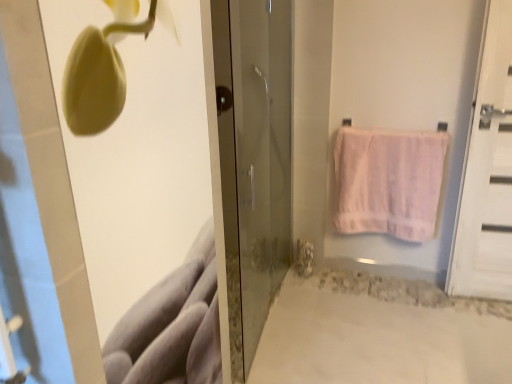
Question: Is transparent glass door at center, which is the second door in right-to-left order, wider than white wooden door at right, which ranks as the second door in left-to-right order?

Choices:
 (A) no
 (B) yes

Answer: (B)

Question: Is transparent glass door at center, which is the second door in right-to-left order, next to white wooden door at right, which ranks as the second door in left-to-right order?

Choices:
 (A) no
 (B) yes

Answer: (A)

Question: Does transparent glass door at center, arranged as the first door when viewed from the left, lie behind white wooden door at right, marked as the 1th door in a right-to-left arrangement?

Choices:
 (A) no
 (B) yes

Answer: (A)

Question: Is transparent glass door at center, arranged as the first door when viewed from the left, shorter than white wooden door at right, which ranks as the second door in left-to-right order?

Choices:
 (A) yes
 (B) no

Answer: (B)

Question: Considering the relative sizes of transparent glass door at center, which is the second door in right-to-left order, and white wooden door at right, which ranks as the second door in left-to-right order, in the image provided, is transparent glass door at center, which is the second door in right-to-left order, taller than white wooden door at right, which ranks as the second door in left-to-right order,?

Choices:
 (A) no
 (B) yes

Answer: (B)

Question: Is transparent glass door at center, which is the second door in right-to-left order, facing away from white wooden door at right, marked as the 1th door in a right-to-left arrangement?

Choices:
 (A) yes
 (B) no

Answer: (B)

Question: Could you tell me if white wooden door at right, which ranks as the second door in left-to-right order, is turned towards transparent glass door at center, which is the second door in right-to-left order?

Choices:
 (A) yes
 (B) no

Answer: (B)

Question: Is white wooden door at right, which ranks as the second door in left-to-right order, far away from transparent glass door at center, which is the second door in right-to-left order?

Choices:
 (A) yes
 (B) no

Answer: (A)

Question: From a real-world perspective, does white wooden door at right, which ranks as the second door in left-to-right order, stand above transparent glass door at center, arranged as the first door when viewed from the left?

Choices:
 (A) no
 (B) yes

Answer: (A)

Question: Is white wooden door at right, which ranks as the second door in left-to-right order, bigger than transparent glass door at center, which is the second door in right-to-left order?

Choices:
 (A) no
 (B) yes

Answer: (A)

Question: From the image's perspective, is white wooden door at right, which ranks as the second door in left-to-right order, beneath transparent glass door at center, arranged as the first door when viewed from the left?

Choices:
 (A) no
 (B) yes

Answer: (A)

Question: Considering the relative positions of white wooden door at right, which ranks as the second door in left-to-right order, and transparent glass door at center, which is the second door in right-to-left order, in the image provided, is white wooden door at right, which ranks as the second door in left-to-right order, to the left of transparent glass door at center, which is the second door in right-to-left order, from the viewer's perspective?

Choices:
 (A) no
 (B) yes

Answer: (A)

Question: Is pink cotton towel at right shorter than transparent glass door at center, arranged as the first door when viewed from the left?

Choices:
 (A) no
 (B) yes

Answer: (B)